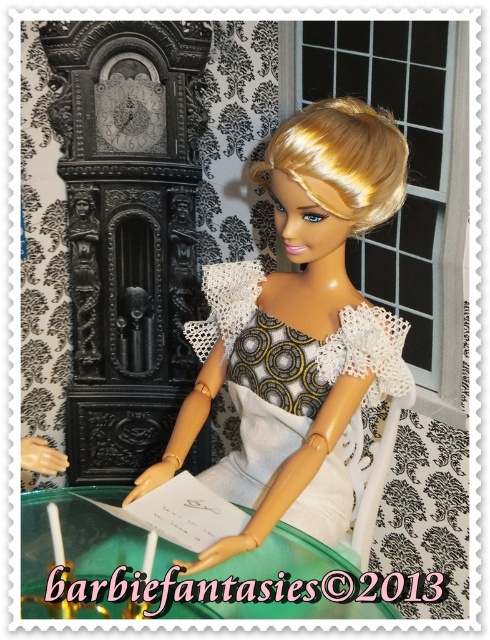
Is point (376, 365) in front of point (325, 339)?

Yes, point (376, 365) is closer to viewer.

Who is more forward, (289, 403) or (206, 285)?

Point (289, 403) is more forward.

Locate an element on the screen. The height and width of the screenshot is (640, 490). matte white dress at center is located at coordinates (297, 330).